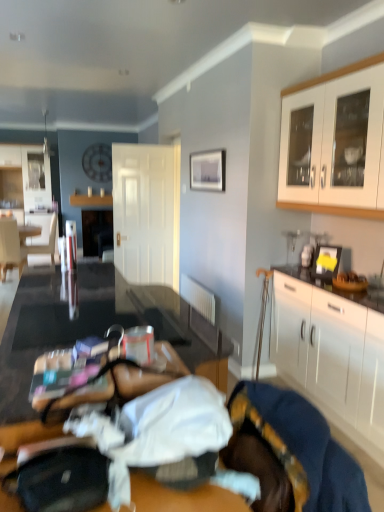
Question: Is velvet blue blanket at lower right closer to the viewer compared to white matte cabinet at right, which ranks as the second cabinetry in top-to-bottom order?

Choices:
 (A) yes
 (B) no

Answer: (A)

Question: From a real-world perspective, is velvet blue blanket at lower right positioned over white matte cabinet at right, the 1th cabinetry when ordered from bottom to top, based on gravity?

Choices:
 (A) no
 (B) yes

Answer: (B)

Question: Considering the relative sizes of velvet blue blanket at lower right and white matte cabinet at right, which ranks as the second cabinetry in top-to-bottom order, in the image provided, is velvet blue blanket at lower right taller than white matte cabinet at right, which ranks as the second cabinetry in top-to-bottom order,?

Choices:
 (A) yes
 (B) no

Answer: (B)

Question: From the image's perspective, is velvet blue blanket at lower right beneath white matte cabinet at right, the 1th cabinetry when ordered from bottom to top?

Choices:
 (A) yes
 (B) no

Answer: (A)

Question: Is velvet blue blanket at lower right to the right of white matte cabinet at right, which ranks as the second cabinetry in top-to-bottom order, from the viewer's perspective?

Choices:
 (A) no
 (B) yes

Answer: (A)

Question: Is velvet blue blanket at lower right wider or thinner than white fabric armchair at left?

Choices:
 (A) wide
 (B) thin

Answer: (B)

Question: Considering the positions of velvet blue blanket at lower right and white fabric armchair at left in the image, is velvet blue blanket at lower right bigger or smaller than white fabric armchair at left?

Choices:
 (A) big
 (B) small

Answer: (B)

Question: From a real-world perspective, is velvet blue blanket at lower right physically located above or below white fabric armchair at left?

Choices:
 (A) below
 (B) above

Answer: (B)

Question: Do you think velvet blue blanket at lower right is within white fabric armchair at left, or outside of it?

Choices:
 (A) outside
 (B) inside

Answer: (A)

Question: From a real-world perspective, is matte white chair at left physically located above or below white glossy cabinet at upper right, which ranks as the 1th cabinetry in top-to-bottom order?

Choices:
 (A) below
 (B) above

Answer: (A)

Question: Relative to white glossy cabinet at upper right, acting as the second cabinetry starting from the bottom, is matte white chair at left in front or behind?

Choices:
 (A) behind
 (B) front

Answer: (A)

Question: Is matte white chair at left situated inside white glossy cabinet at upper right, acting as the second cabinetry starting from the bottom, or outside?

Choices:
 (A) inside
 (B) outside

Answer: (B)

Question: From the image's perspective, relative to white glossy cabinet at upper right, which ranks as the 1th cabinetry in top-to-bottom order, is matte white chair at left above or below?

Choices:
 (A) above
 (B) below

Answer: (B)

Question: From the image's perspective, is white matte door at center located above or below wooden table at lower left?

Choices:
 (A) above
 (B) below

Answer: (A)

Question: From a real-world perspective, is white matte door at center positioned above or below wooden table at lower left?

Choices:
 (A) below
 (B) above

Answer: (B)